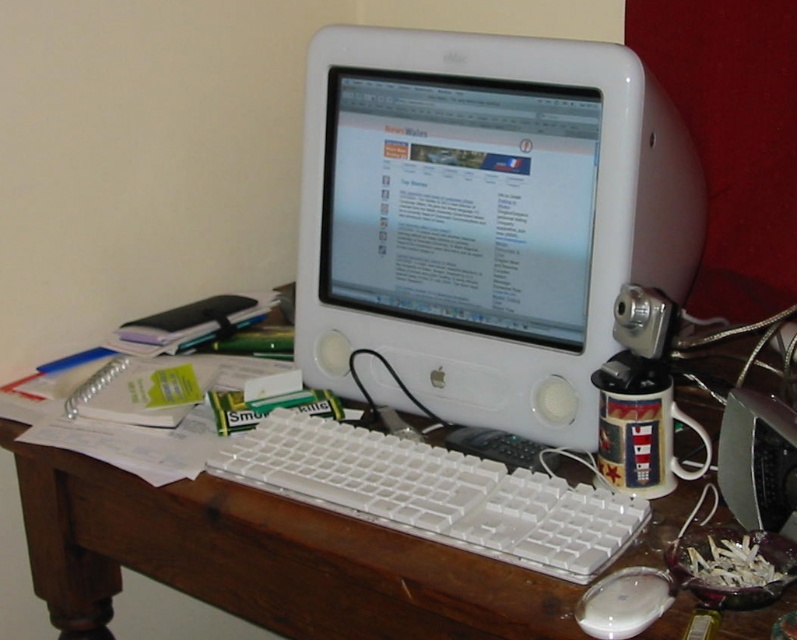
You are a delivery person who just arrived at the office. You need to place a small package on the desk without blocking the mouse. The package is 3 inches long. Is there enough space between the wooden desk at center and the white glossy mouse at lower center to place the package?

The wooden desk at center and white glossy mouse at lower center are 13.07 inches apart. Since the package is only 3 inches long, there is sufficient space to place it between them without blocking the mouse.

You are trying to place a new keyboard on the wooden desk at center. The keyboard is 10 inches wide. Can the white glossy mouse at lower center fit alongside the keyboard on the desk without overlapping?

The wooden desk at center might be wider than the white glossy mouse at lower center, so there is a possibility that the keyboard and mouse can fit side by side. However, the exact dimensions are uncertain. Check the desk width before placing them.

Based on the photo, you are organizing the desk and need to place a new item between the white plastic monitor at center and the white glossy mouse at lower center. Considering their sizes, which object should you place closer to the edge of the desk to ensure the new item fits comfortably?

The white glossy mouse at lower center is smaller in height compared to the white plastic monitor at center. To ensure the new item fits comfortably, place the white glossy mouse at lower center closer to the edge of the desk since it takes up less vertical space.